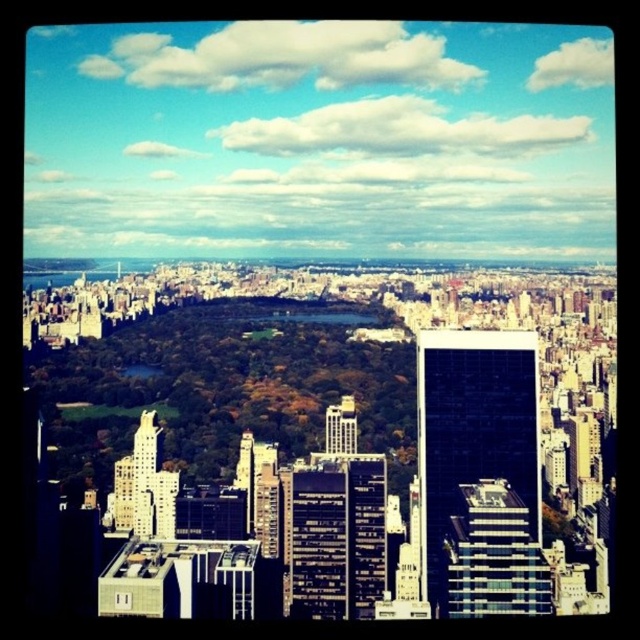
Question: Is white glass building at center-left to the left of metallic glass skyscraper at center from the viewer's perspective?

Choices:
 (A) no
 (B) yes

Answer: (B)

Question: Which point is closer to the camera?

Choices:
 (A) white glass building at center-left
 (B) white glass building at center
 (C) black glass building at right

Answer: (C)

Question: Which point is closer to the camera taking this photo?

Choices:
 (A) (518, 376)
 (B) (132, 522)
 (C) (342, 410)
 (D) (493, 493)

Answer: (C)

Question: Which of the following is the farthest from the observer?

Choices:
 (A) metallic glass skyscraper at center
 (B) white glass building at center-left
 (C) black glass building at right

Answer: (B)

Question: Is black glass building at right wider than white glass building at center?

Choices:
 (A) no
 (B) yes

Answer: (B)

Question: Does white glass building at center-left appear on the right side of metallic glass skyscraper at center?

Choices:
 (A) no
 (B) yes

Answer: (A)